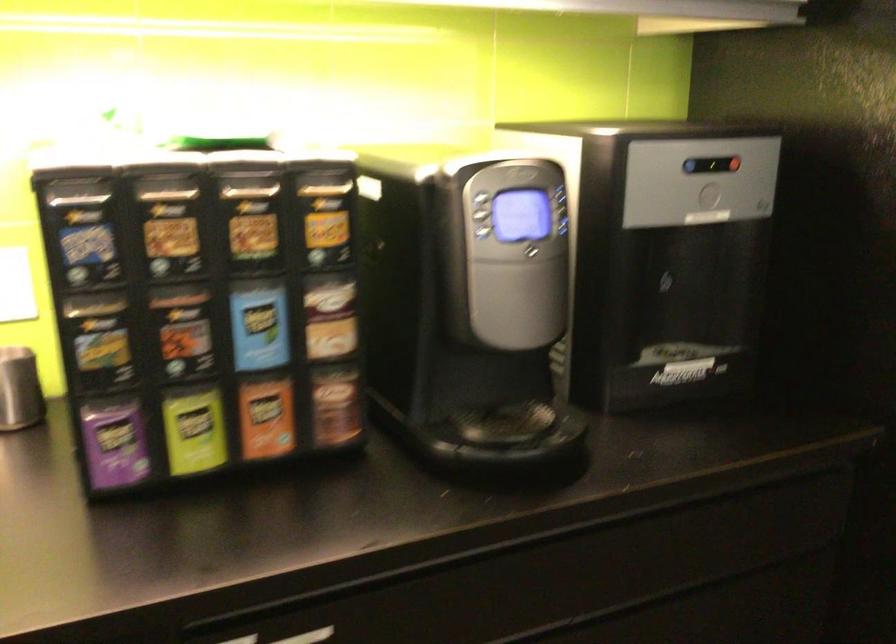
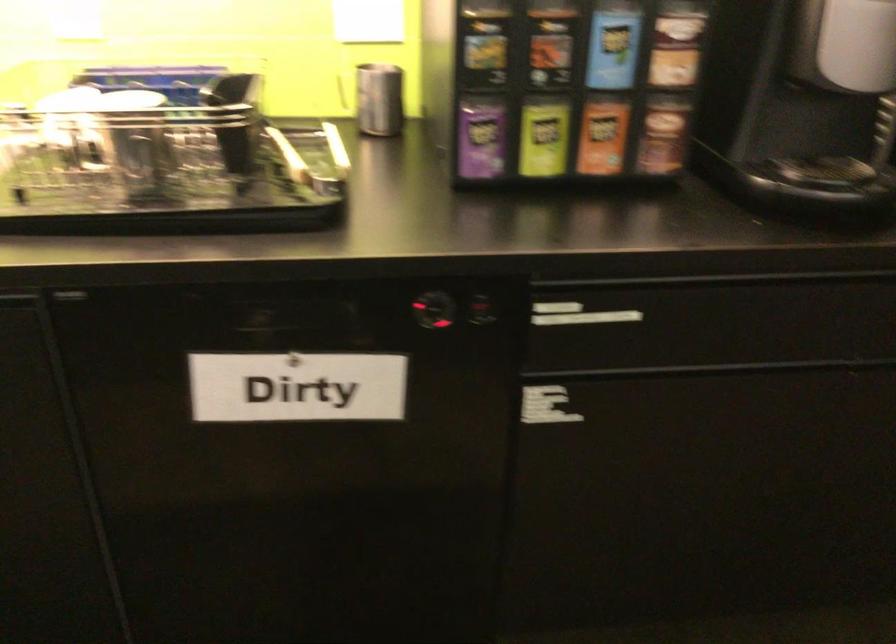
Where in the second image is the point corresponding to point 265,415 from the first image?

(602, 136)